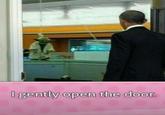
You are a GUI agent. You are given a task and a screenshot of the screen. Output one action in this format:
    pyautogui.click(x=<x>, y=<y>)
    Task: Click on the doorway
    This screenshot has height=115, width=165.
    Given the screenshot: What is the action you would take?
    pyautogui.click(x=66, y=68)